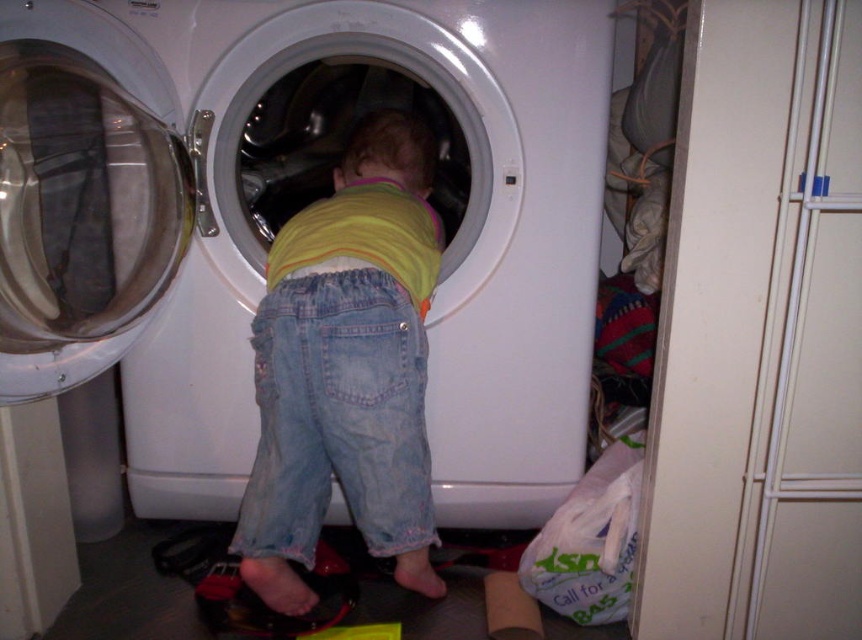
You are a parent trying to ensure your child is safe near the white glossy washing machine at center and the denim pants at center. Considering their sizes, which object is wider?

The white glossy washing machine at center is wider than the denim pants at center.

You are a parent trying to ensure your child is safe. The child is inside the white glossy washing machine at center and standing on the denim pants at center. Considering the height difference between the two, is there a risk of the child being trapped inside the washing machine?

The white glossy washing machine at center is much taller than the denim pants at center. Since the washing machine is significantly taller, the child might not be able to reach the top of the machine, potentially leading to a risk of being trapped inside.

Looking at this image, you are a delivery person who just arrived at a house. You need to place a new washing machine exactly where the old one was located. The old washing machine was at point (291, 212). Can you tell me where that is in the image?

The point (291, 212) marks the location of the white glossy washing machine at center. So you should place the new washing machine exactly where the white glossy washing machine at center is currently positioned.